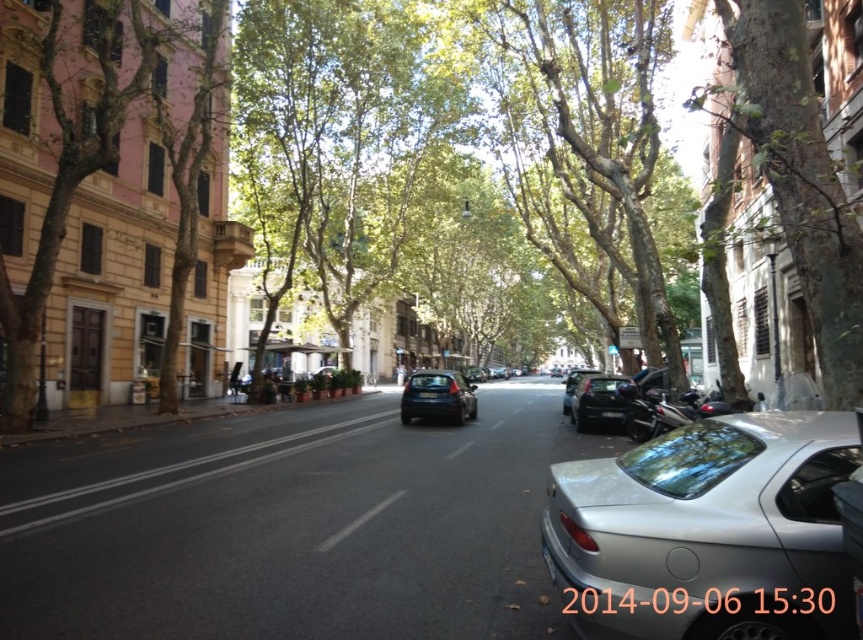
Question: Does green leafy tree at right have a lesser width compared to shiny black car at center?

Choices:
 (A) yes
 (B) no

Answer: (A)

Question: Does shiny blue sedan at center appear under shiny black car at center?

Choices:
 (A) yes
 (B) no

Answer: (B)

Question: Which object appears farthest from the camera in this image?

Choices:
 (A) silver metallic car at center
 (B) black asphalt road at center
 (C) shiny blue sedan at center

Answer: (C)

Question: Among these objects, which one is nearest to the camera?

Choices:
 (A) silver metallic car at center
 (B) green leafy tree at right

Answer: (A)

Question: Which point is farther from the camera taking this photo?

Choices:
 (A) (589, 397)
 (B) (765, 248)
 (C) (591, 371)

Answer: (C)

Question: Where is green leafy tree at right located in relation to glossy black car at center in the image?

Choices:
 (A) right
 (B) left

Answer: (A)